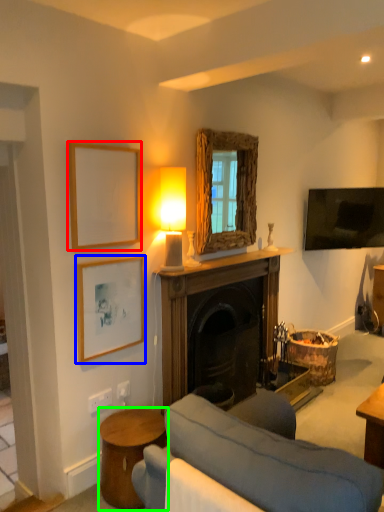
Question: Which object is the closest to the picture frame (highlighted by a red box)? Choose among these: picture frame (highlighted by a blue box) or table (highlighted by a green box).

Choices:
 (A) picture frame
 (B) table

Answer: (A)